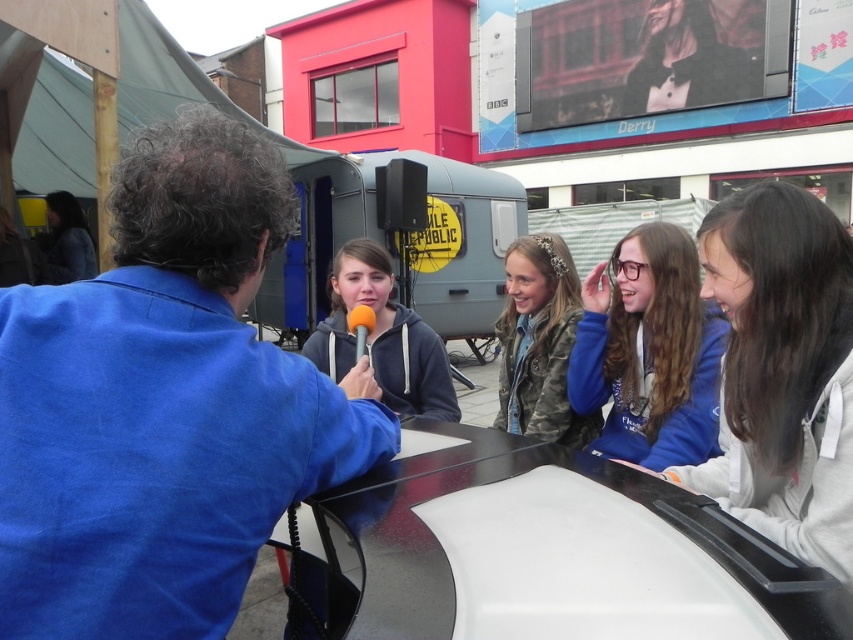
Question: Can you confirm if black polished table at lower center is smaller than matte gray hoodie at center?

Choices:
 (A) no
 (B) yes

Answer: (A)

Question: Does light gray hoodie at right appear over matte gray hoodie at center?

Choices:
 (A) no
 (B) yes

Answer: (A)

Question: Which object is closer to the camera taking this photo?

Choices:
 (A) orange foam microphone at center
 (B) black polished table at lower center
 (C) light gray hoodie at right

Answer: (B)

Question: Observing the image, what is the correct spatial positioning of metallic silver trailer at center in reference to dark blue jacket at left?

Choices:
 (A) right
 (B) left

Answer: (A)

Question: Which point appears farthest from the camera in this image?

Choices:
 (A) (514, 552)
 (B) (94, 266)

Answer: (B)

Question: Which of the following is the farthest from the observer?

Choices:
 (A) (363, 156)
 (B) (67, 205)

Answer: (A)